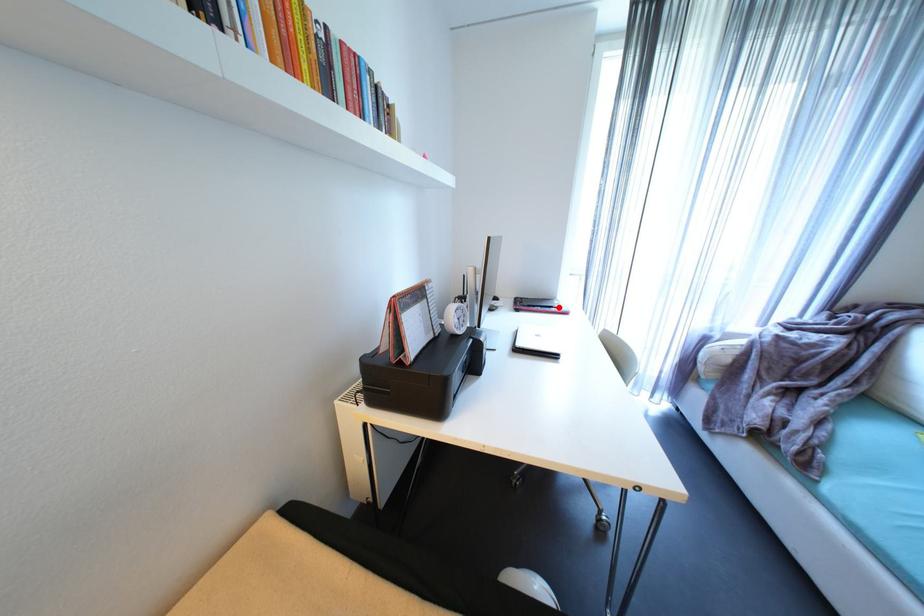
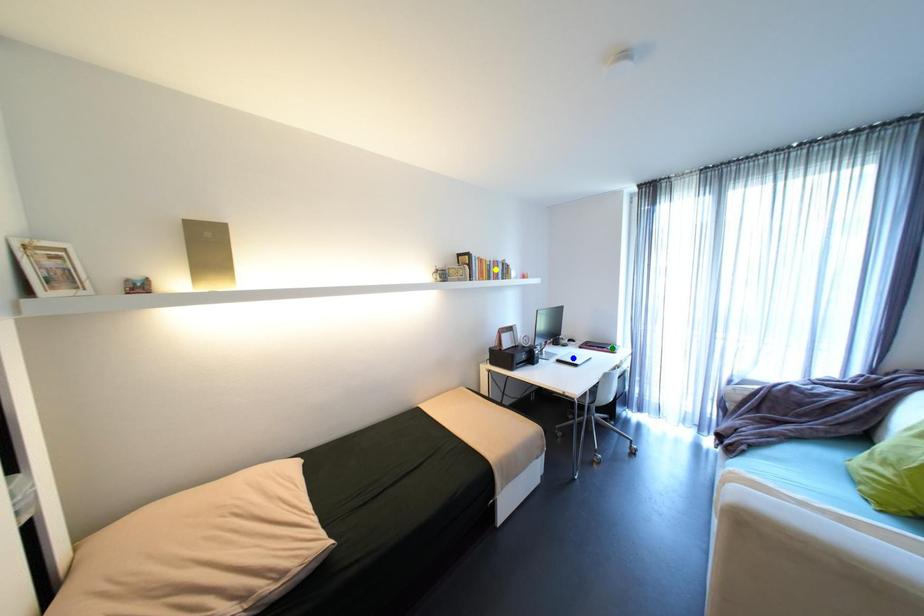
Question: I am providing you with two images of the same scene from different viewpoints. A red point is marked on the first image. You are given multiple points on the second image. Which spot in image 2 lines up with the point in image 1?

Choices:
 (A) green point
 (B) yellow point
 (C) blue point

Answer: (A)